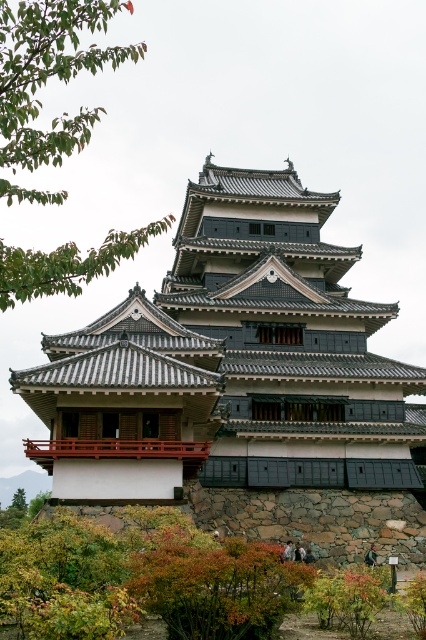
Between green leafy branch at upper left and green leafy tree at lower left, which one appears on the right side from the viewer's perspective?

Positioned to the right is green leafy branch at upper left.

Can you confirm if green leafy branch at upper left is positioned to the left of green leafy tree at lower left?

Incorrect, green leafy branch at upper left is not on the left side of green leafy tree at lower left.

Who is more distant from viewer, (85, 22) or (23, 500)?

Positioned behind is point (23, 500).

The width and height of the screenshot is (426, 640). What are the coordinates of `green leafy branch at upper left` in the screenshot? It's located at (49, 74).

Can you confirm if stone gray temple at center is positioned to the left of green leafy tree at lower left?

In fact, stone gray temple at center is to the right of green leafy tree at lower left.

Which is more to the right, stone gray temple at center or green leafy tree at lower left?

stone gray temple at center is more to the right.

Where is `stone gray temple at center`? stone gray temple at center is located at coordinates (241, 384).

I want to click on stone gray temple at center, so click(241, 384).

Does stone gray temple at center have a smaller size compared to green leafy branch at upper left?

Yes.

This screenshot has width=426, height=640. Describe the element at coordinates (241, 384) in the screenshot. I see `stone gray temple at center` at that location.

At what (x,y) coordinates should I click in order to perform the action: click on stone gray temple at center. Please return your answer as a coordinate pair (x, y). Image resolution: width=426 pixels, height=640 pixels. Looking at the image, I should click on (241, 384).